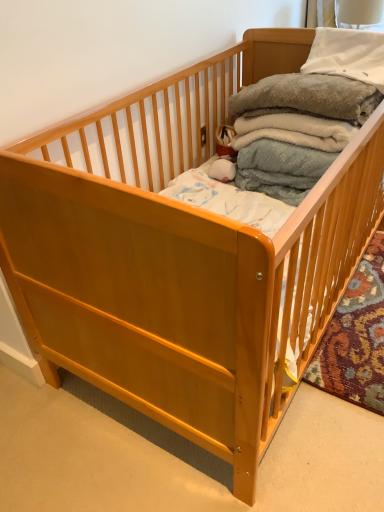
What are the coordinates of `soft gray fleece blanket at upper right` in the screenshot? It's located at (307, 101).

Measure the distance between point (298, 126) and camera.

Point (298, 126) and camera are 5.19 feet apart.

What do you see at coordinates (307, 101) in the screenshot? The width and height of the screenshot is (384, 512). I see `soft gray fleece blanket at upper right` at bounding box center [307, 101].

This screenshot has height=512, width=384. Identify the location of soft gray fleece blanket at upper right. (307, 101).